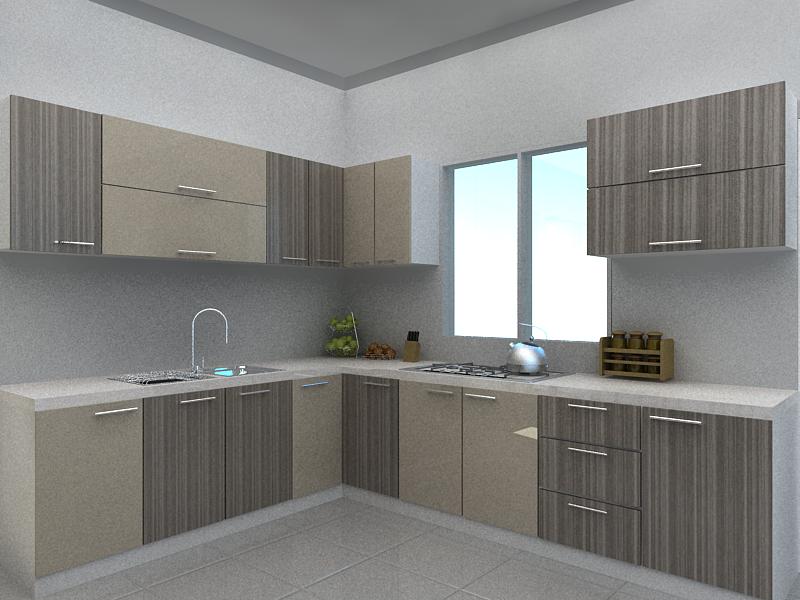
The width and height of the screenshot is (800, 600). What are the coordinates of `sink` in the screenshot? It's located at (226, 372).